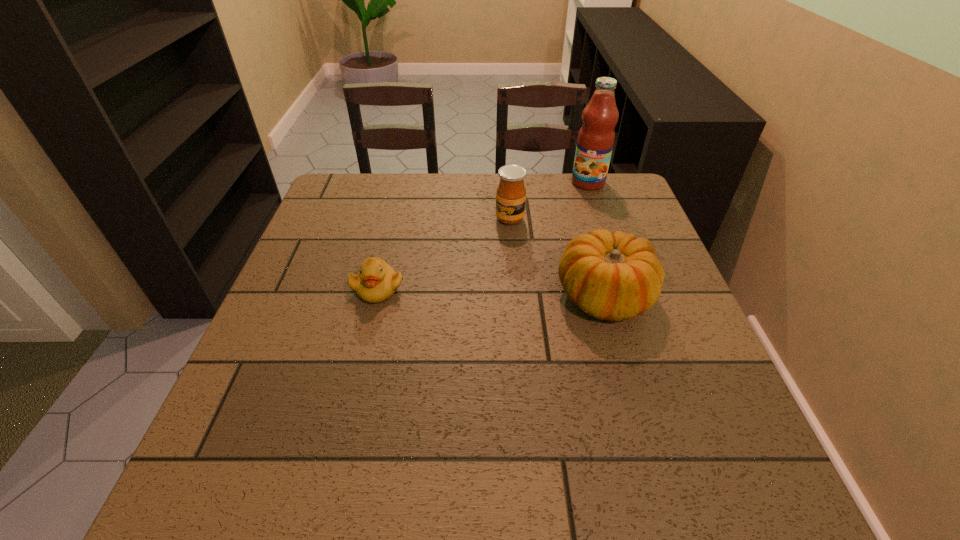
Identify the location of duckling. (376, 282).

This screenshot has width=960, height=540. Find the location of `the leftmost object`. the leftmost object is located at coordinates (376, 282).

Find the location of a particular element. gourd is located at coordinates (613, 276).

I want to click on the farthest object, so click(596, 137).

The width and height of the screenshot is (960, 540). What are the coordinates of `fruit juice` in the screenshot? It's located at (596, 137).

Where is `honey`? honey is located at coordinates (511, 193).

This screenshot has width=960, height=540. What are the coordinates of `the second object from left to right` in the screenshot? It's located at (511, 193).

Image resolution: width=960 pixels, height=540 pixels. I want to click on free space located 0.120m at the beak of the shortest object, so click(x=362, y=350).

This screenshot has width=960, height=540. I want to click on free location located on the left of the gourd, so click(414, 297).

Where is `blank space located on the front label of the farthest object`? blank space located on the front label of the farthest object is located at coordinates (567, 214).